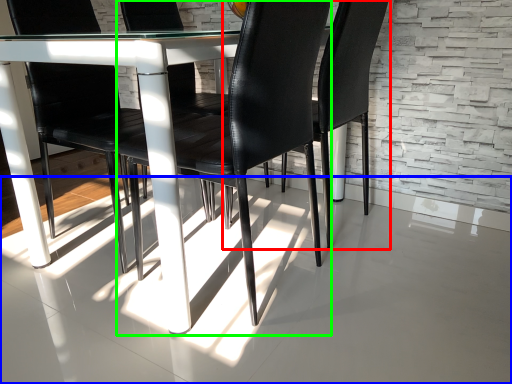
Question: Which is farther away from chair (highlighted by a red box)? concrete (highlighted by a blue box) or chair (highlighted by a green box)?

Choices:
 (A) concrete
 (B) chair

Answer: (A)